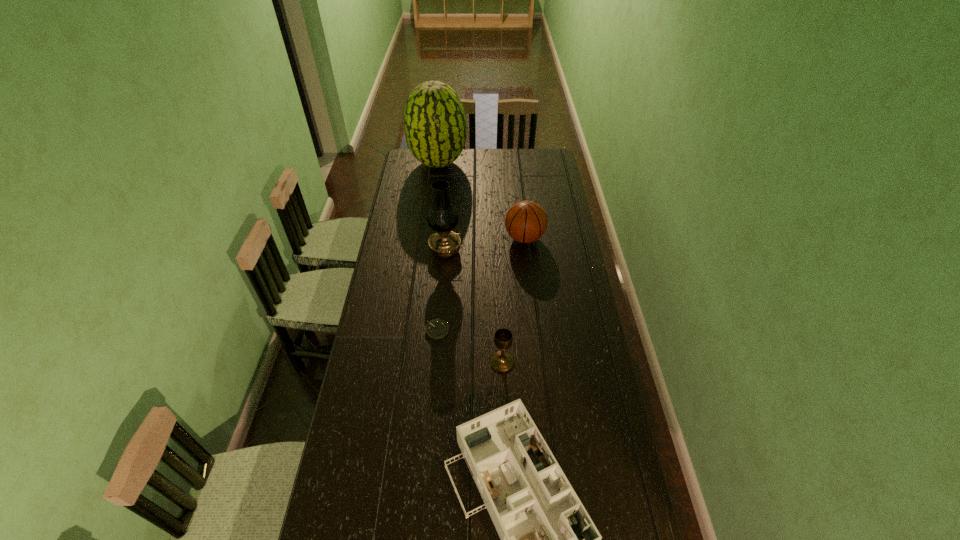
In order to click on watermelon in this screenshot , I will do `click(435, 125)`.

Locate an element on the screen. This screenshot has height=540, width=960. the farthest object is located at coordinates (435, 125).

The width and height of the screenshot is (960, 540). I want to click on the fifth shortest object, so click(442, 217).

I want to click on basketball, so click(x=526, y=221).

Where is `the fifth farthest object`? The height and width of the screenshot is (540, 960). the fifth farthest object is located at coordinates (502, 361).

Image resolution: width=960 pixels, height=540 pixels. I want to click on the third shortest object, so tap(502, 361).

I want to click on the fourth farthest object, so click(436, 329).

At what (x,y) coordinates should I click in order to perform the action: click on ashtray. Please return your answer as a coordinate pair (x, y). Image resolution: width=960 pixels, height=540 pixels. Looking at the image, I should click on (436, 329).

Locate an element on the screen. The width and height of the screenshot is (960, 540). free location located on the right of the tallest object is located at coordinates (478, 163).

At what (x,y) coordinates should I click in order to perform the action: click on free location located on the front of the second tallest object. Please return your answer as a coordinate pair (x, y). The image size is (960, 540). Looking at the image, I should click on (442, 293).